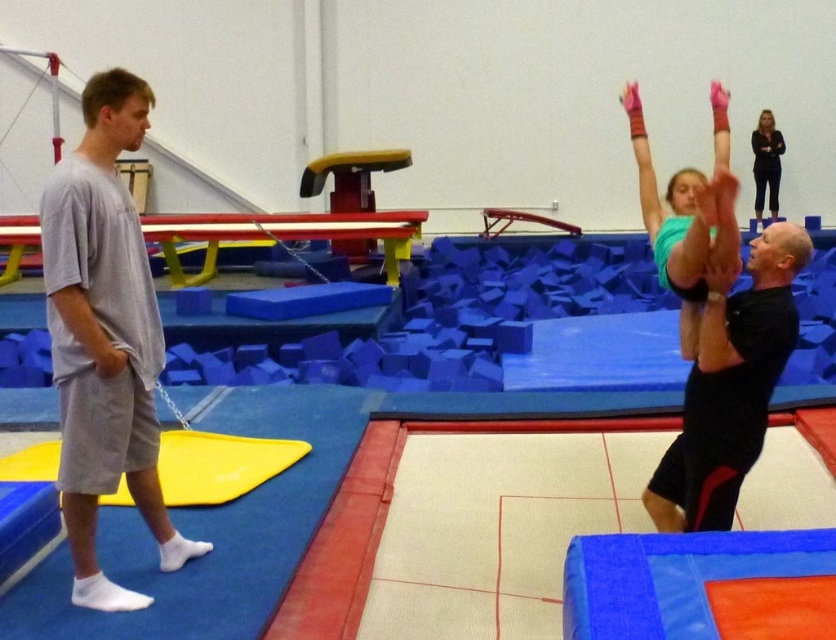
Question: Which object appears farthest from the camera in this image?

Choices:
 (A) gray cotton shorts at left
 (B) dark blue jeans at upper right
 (C) black matte shirt at upper right

Answer: (B)

Question: Where is black matte shirt at upper right located in relation to gray cotton shirt at left in the image?

Choices:
 (A) above
 (B) below

Answer: (B)

Question: Where is gray cotton shirt at left located in relation to dark blue jeans at upper right in the image?

Choices:
 (A) right
 (B) left

Answer: (B)

Question: Which object is farther from the camera taking this photo?

Choices:
 (A) gray cotton shorts at left
 (B) black matte shirt at upper right
 (C) dark blue jeans at upper right

Answer: (C)

Question: Can you confirm if gray cotton shorts at left is thinner than gray cotton shirt at left?

Choices:
 (A) yes
 (B) no

Answer: (B)

Question: Which point appears closest to the camera in this image?

Choices:
 (A) (784, 305)
 (B) (79, 320)
 (C) (115, 300)

Answer: (B)